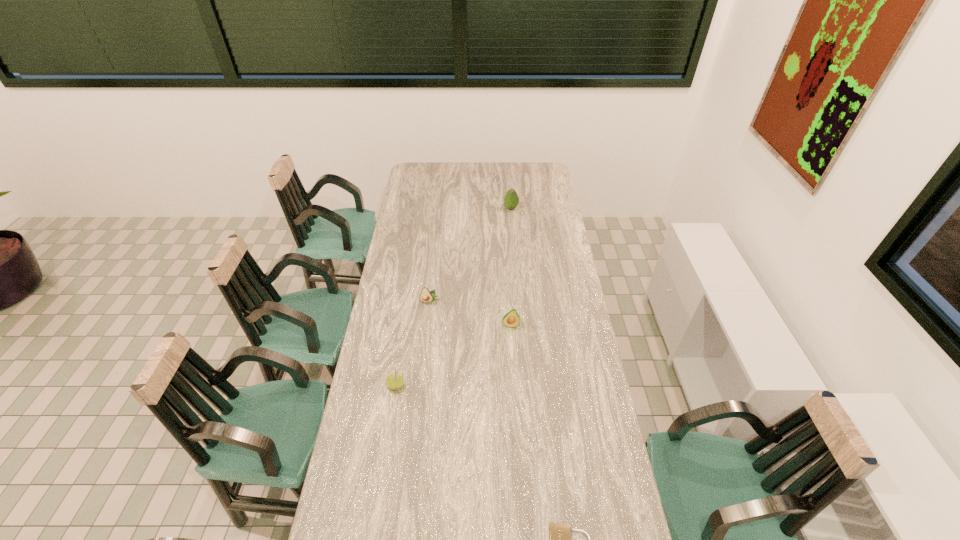
Image resolution: width=960 pixels, height=540 pixels. In order to click on object that is at the left edge in this screenshot , I will do `click(395, 381)`.

Locate an element on the screen. Image resolution: width=960 pixels, height=540 pixels. free region at the far edge is located at coordinates (460, 180).

Identify the location of vacant point at the left edge. (386, 343).

Where is `free space at the right edge of the desktop`? free space at the right edge of the desktop is located at coordinates (589, 438).

Where is `free region at the far right corner of the desktop`? free region at the far right corner of the desktop is located at coordinates (543, 167).

Image resolution: width=960 pixels, height=540 pixels. I want to click on blank region between the farthest avocado and the nearest avocado, so click(x=511, y=267).

At what (x,y) coordinates should I click in order to perform the action: click on free spot between the leftmost object and the second nearest avocado. Please return your answer as a coordinate pair (x, y). This screenshot has width=960, height=540. Looking at the image, I should click on (413, 344).

Find the location of a particular element. The height and width of the screenshot is (540, 960). blank region between the pear and the leftmost avocado is located at coordinates (413, 344).

The height and width of the screenshot is (540, 960). Identify the location of vacant region between the leftmost object and the farthest object. (453, 297).

Where is `blank region between the nearest avocado and the leftmost object`? blank region between the nearest avocado and the leftmost object is located at coordinates (453, 355).